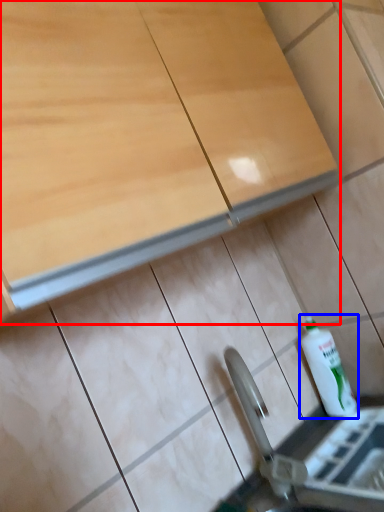
Question: Which of the following is the closest to the observer, cabinetry (highlighted by a red box) or bottle (highlighted by a blue box)?

Choices:
 (A) cabinetry
 (B) bottle

Answer: (A)